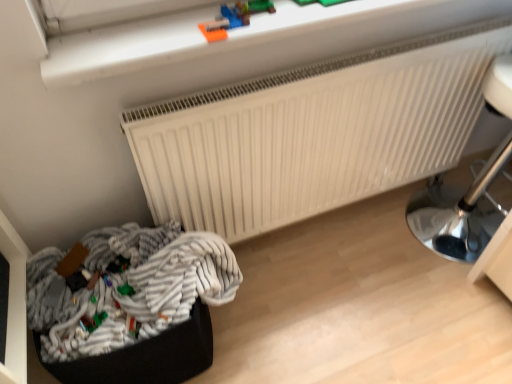
This screenshot has width=512, height=384. I want to click on vacant space that's between metallic silver lamp at right and striped fabric laundry at lower left, so click(335, 274).